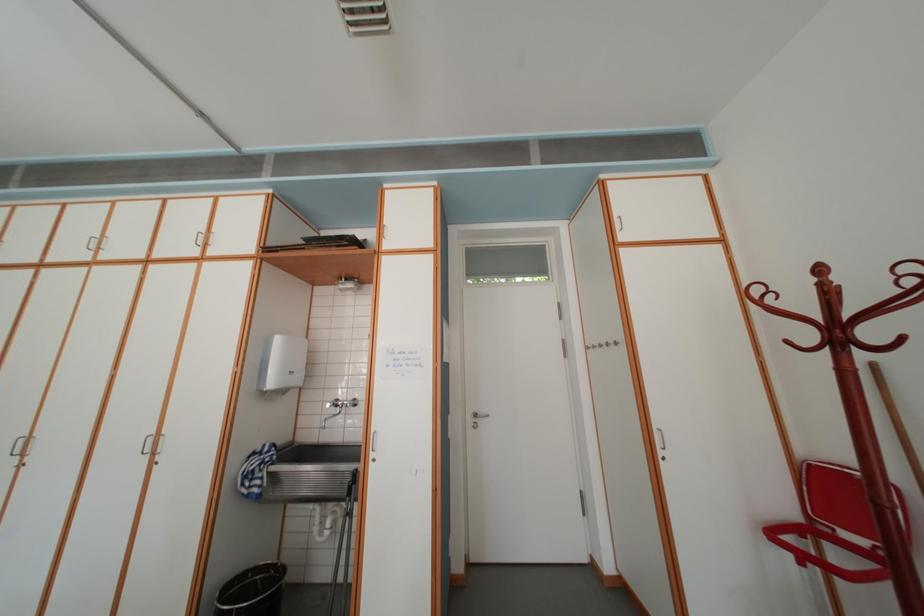
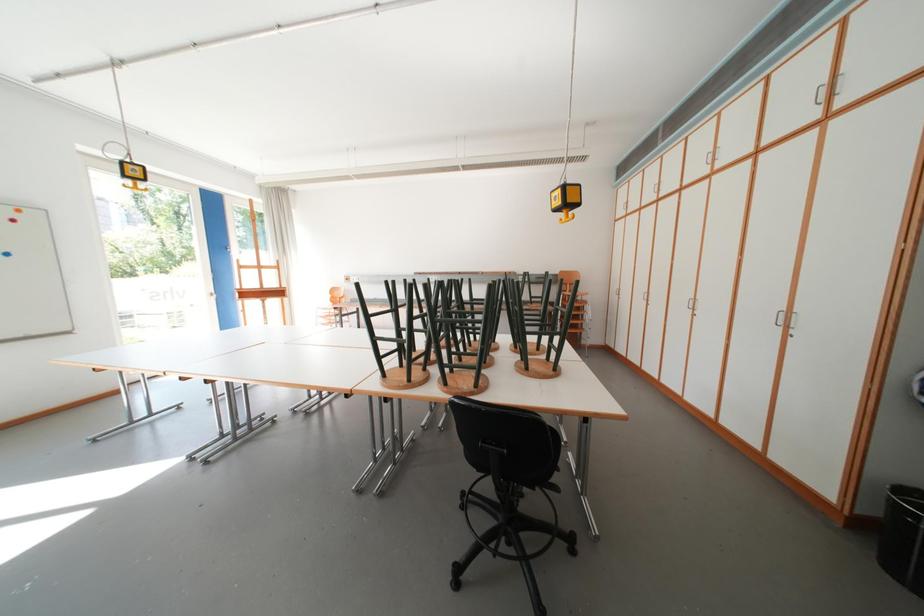
Question: The images are taken continuously from a first-person perspective. In which direction is your viewpoint rotating?

Choices:
 (A) Left
 (B) Right
 (C) Up
 (D) Down

Answer: (A)